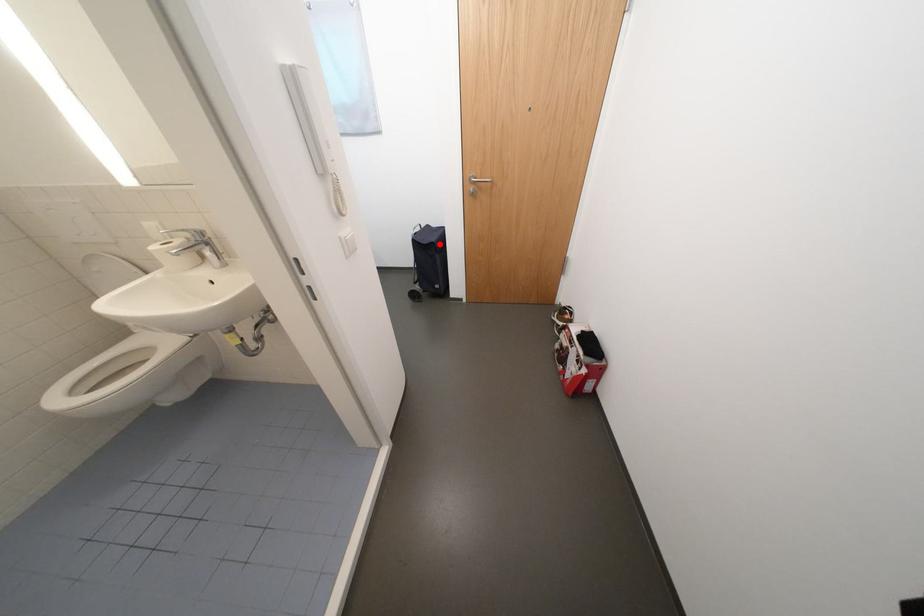
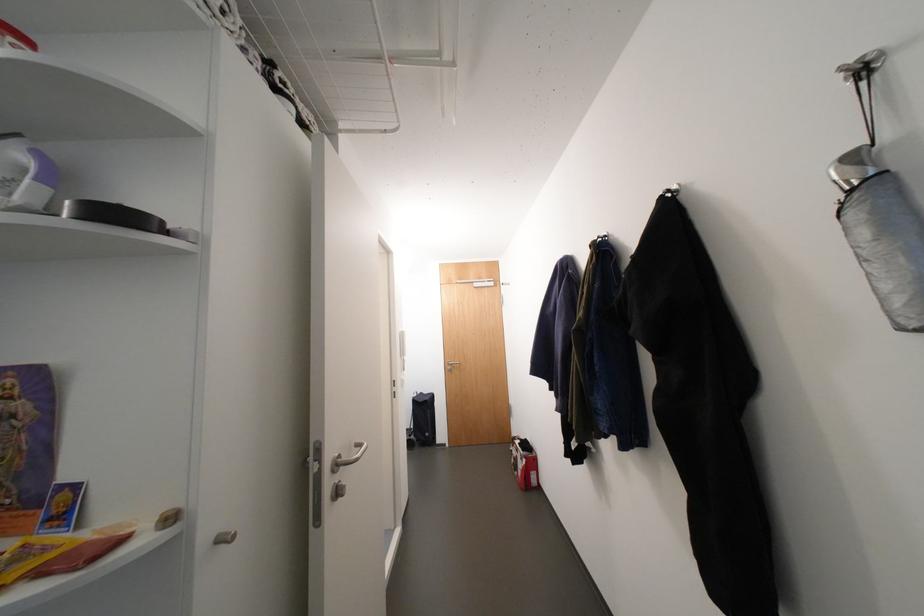
Question: A red point is marked in image1. In image2, is the corresponding 3D point closer to the camera or farther? Reply with the corresponding letter.

Choices:
 (A) The corresponding 3D point is closer.
 (B) The corresponding 3D point is farther.

Answer: (B)